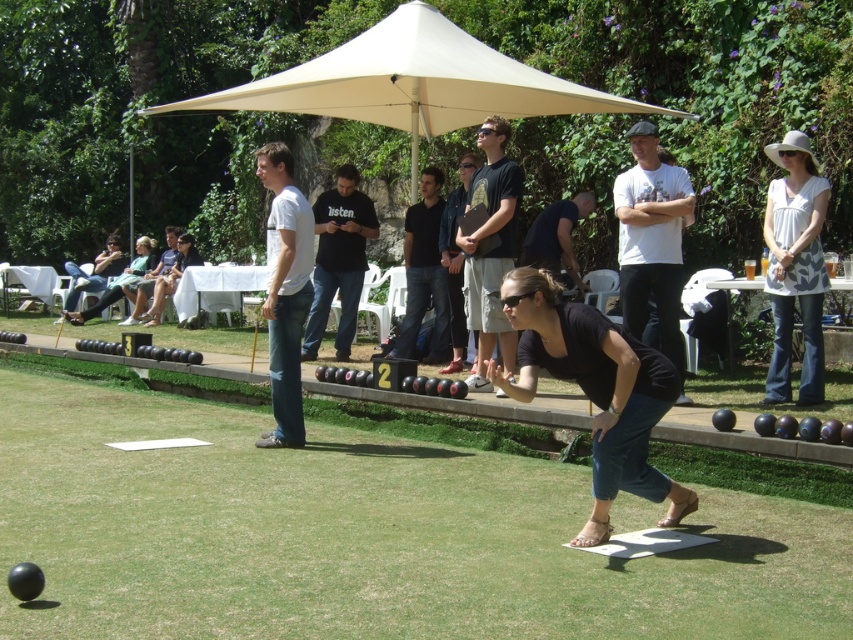
You are standing in the outdoor bowling area and want to know which point is nearer to you. The points are point (665, 490) and point (786, 172). Which one is closer?

Point (665, 490) is closer to the viewer than point (786, 172).

You are organizing a clothing display and need to place the black matte shirt at center and the white cotton shirt at upper right side by side. Based on their widths, which shirt should be placed on the left to avoid overcrowding the display?

The black matte shirt at center should be placed on the left because it is wider than the white cotton shirt at upper right, allowing more space between them.